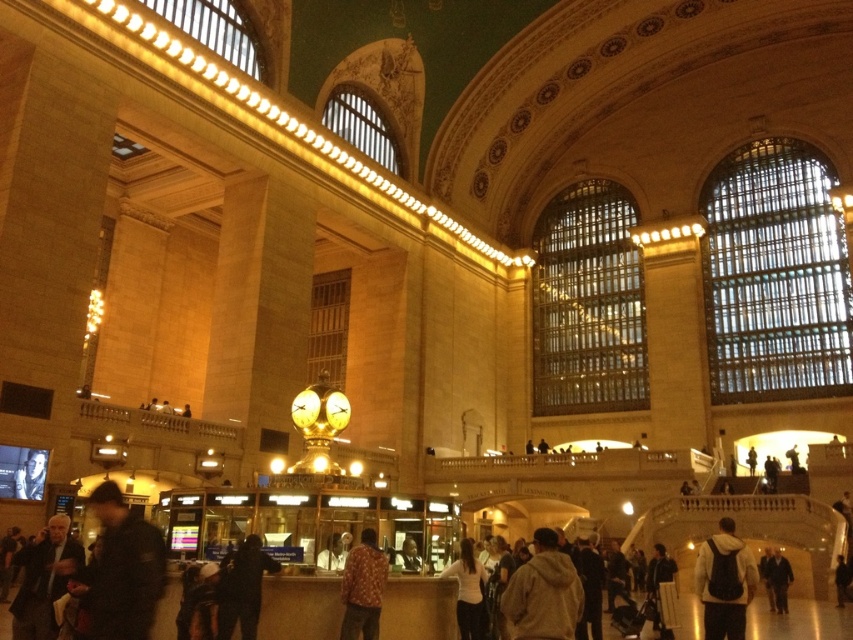
Is dark gray jacket at lower left to the left of white hoodie at center from the viewer's perspective?

Yes, dark gray jacket at lower left is to the left of white hoodie at center.

Locate an element on the screen. This screenshot has height=640, width=853. dark gray jacket at lower left is located at coordinates (44, 579).

Is point (39, 552) behind point (753, 570)?

Yes, point (39, 552) is farther from viewer.

Identify the location of dark gray jacket at lower left. (44, 579).

Can you confirm if dark brown leather jacket at lower left is shorter than white hoodie at center?

Correct, dark brown leather jacket at lower left is not as tall as white hoodie at center.

Where is `dark brown leather jacket at lower left`? dark brown leather jacket at lower left is located at coordinates (122, 570).

I want to click on dark brown leather jacket at lower left, so click(x=122, y=570).

Between point (575, 602) and point (248, 602), which one is positioned behind?

Positioned behind is point (248, 602).

Is light brown hoodie at center taller than dark gray hoodie at lower center?

Indeed, light brown hoodie at center has a greater height compared to dark gray hoodie at lower center.

You are a GUI agent. You are given a task and a screenshot of the screen. Output one action in this format:
    pyautogui.click(x=<x>, y=<y>)
    Task: Click on the light brown hoodie at center
    This screenshot has width=853, height=640.
    Given the screenshot: What is the action you would take?
    pyautogui.click(x=543, y=593)